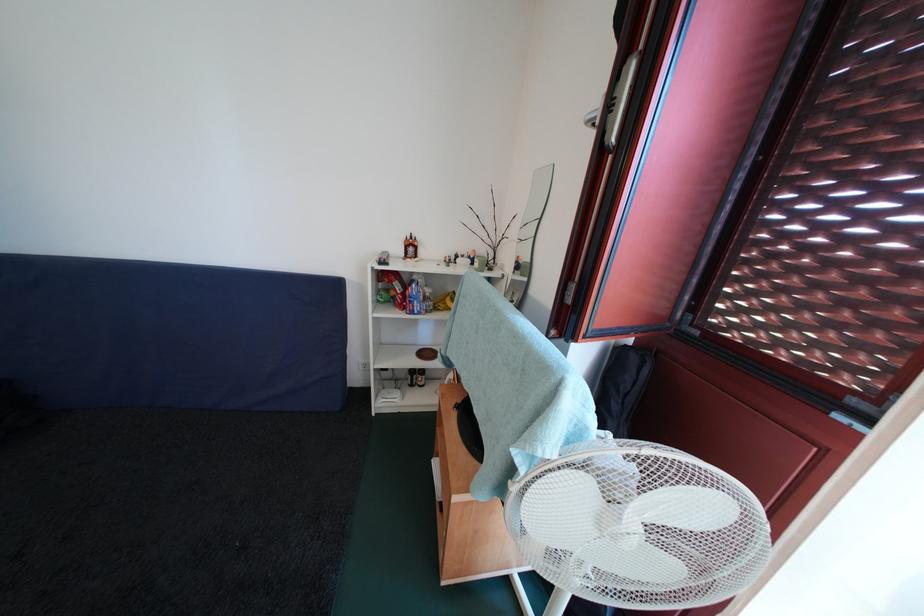
The location [414,299] corresponds to which object?

It corresponds to the blue food bag in the image.